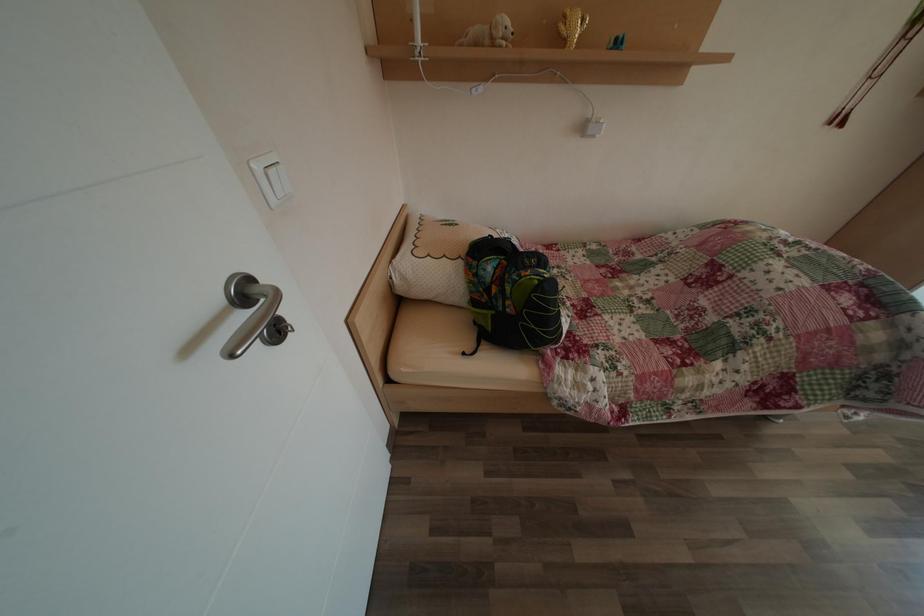
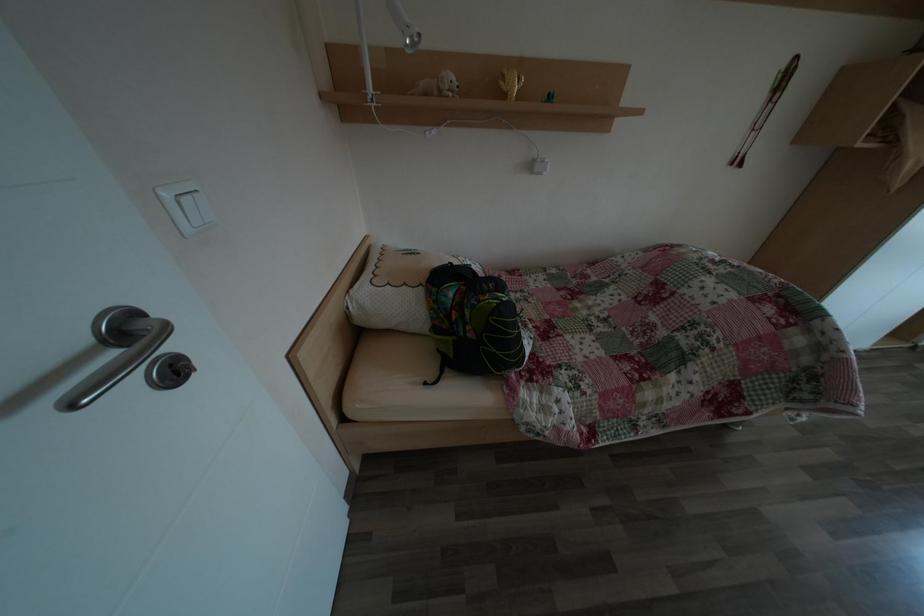
Question: The images are taken continuously from a first-person perspective. In which direction are you moving?

Choices:
 (A) Left
 (B) Right
 (C) Forward
 (D) Backward

Answer: (B)